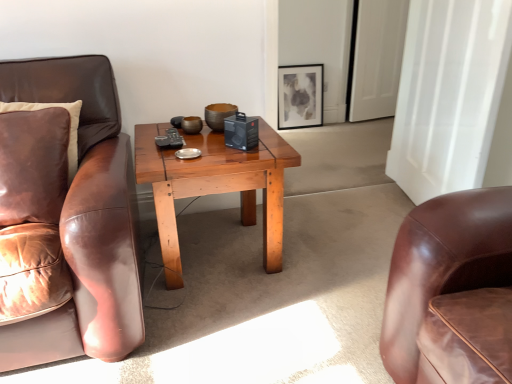
You are a GUI agent. You are given a task and a screenshot of the screen. Output one action in this format:
    pyautogui.click(x=<x>, y=<y>)
    Task: Click on the space that is in front of wooden coffee table at center
    The width and height of the screenshot is (512, 384).
    Given the screenshot: What is the action you would take?
    pyautogui.click(x=231, y=334)